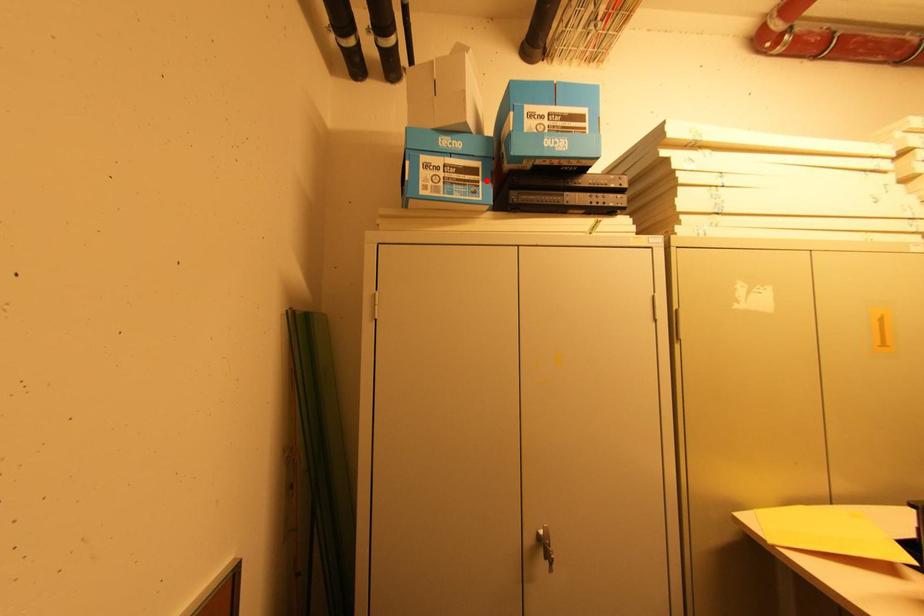
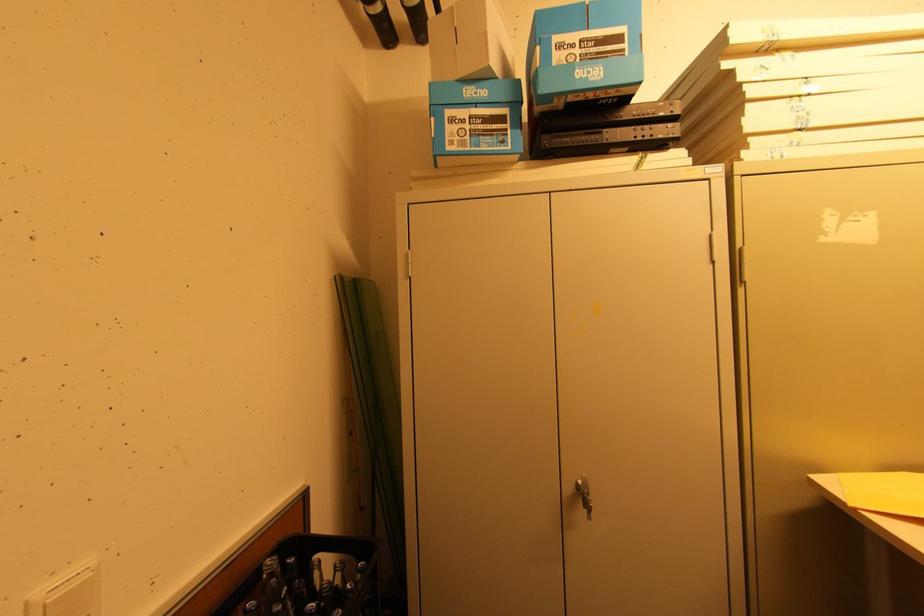
Question: I am providing you with two images of the same scene from different viewpoints. A red point is marked on the first image. At the location where the point appears in image 1, is it still visible in image 2?

Choices:
 (A) Yes
 (B) No

Answer: (A)